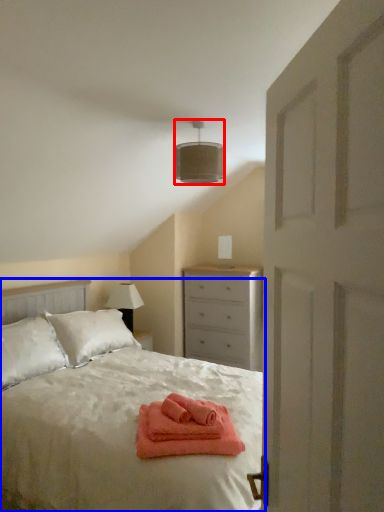
Question: Which of the following is the farthest to the observer, lamp (highlighted by a red box) or bed (highlighted by a blue box)?

Choices:
 (A) lamp
 (B) bed

Answer: (A)